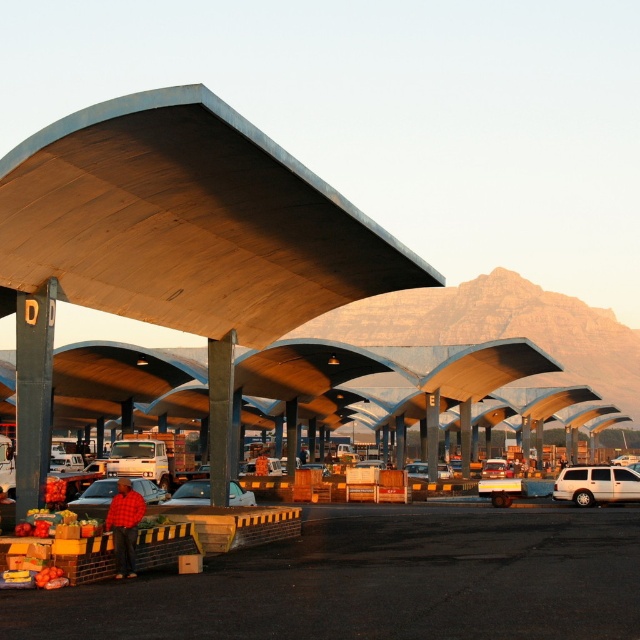
Question: Among these objects, which one is nearest to the camera?

Choices:
 (A) shiny red apples at lower left
 (B) metallic silver car at center
 (C) metallic silver van at center
 (D) silver metallic station wagon at right

Answer: (A)

Question: Which object appears closest to the camera in this image?

Choices:
 (A) silver metallic station wagon at right
 (B) metallic silver van at center

Answer: (A)

Question: Is metallic silver car at center further to camera compared to shiny red apples at lower left?

Choices:
 (A) no
 (B) yes

Answer: (B)

Question: Which point appears farthest from the camera in this image?

Choices:
 (A) (100, 493)
 (B) (202, 493)
 (C) (499, 476)
 (D) (61, 497)

Answer: (C)

Question: Does matte black car at center have a smaller size compared to shiny red apples at lower left?

Choices:
 (A) no
 (B) yes

Answer: (B)

Question: Is metallic silver car at center positioned behind shiny red apples at lower left?

Choices:
 (A) no
 (B) yes

Answer: (B)